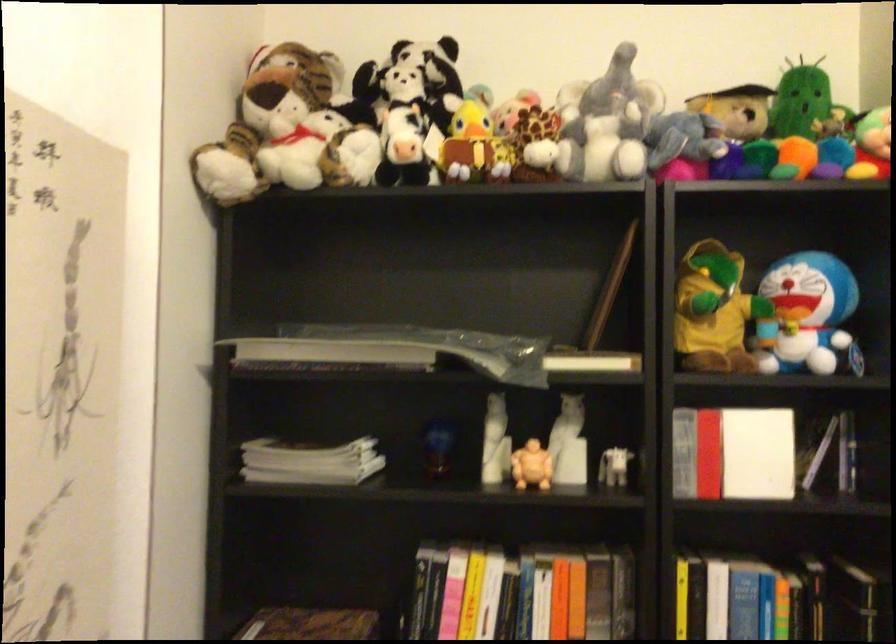
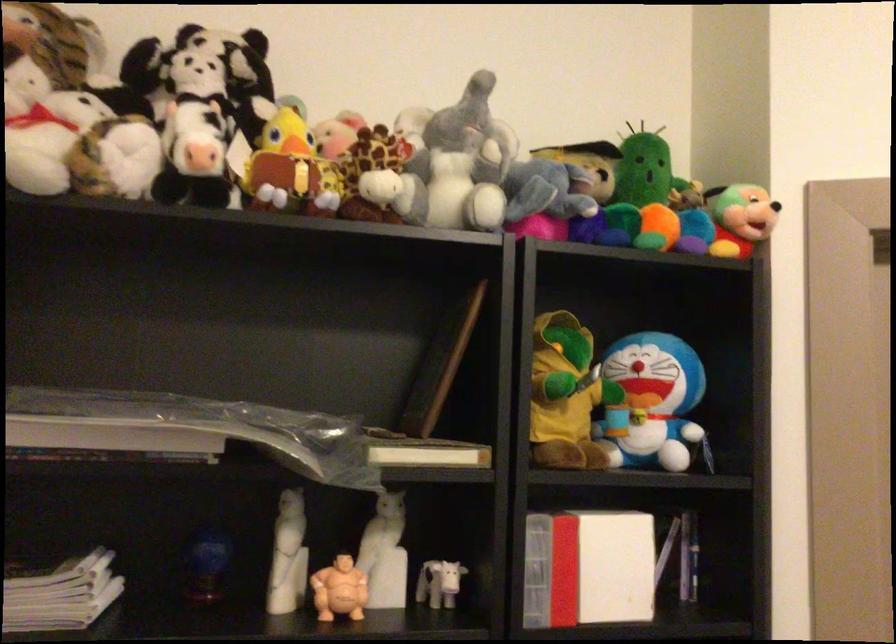
Locate, in the second image, the point that corresponds to (x=471, y=147) in the first image.

(290, 169)